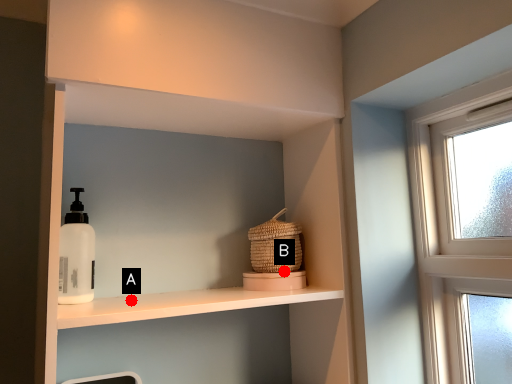
Question: Two points are circled on the image, labeled by A and B beside each circle. Among these points, which one is nearest to the camera?

Choices:
 (A) A is closer
 (B) B is closer

Answer: (A)